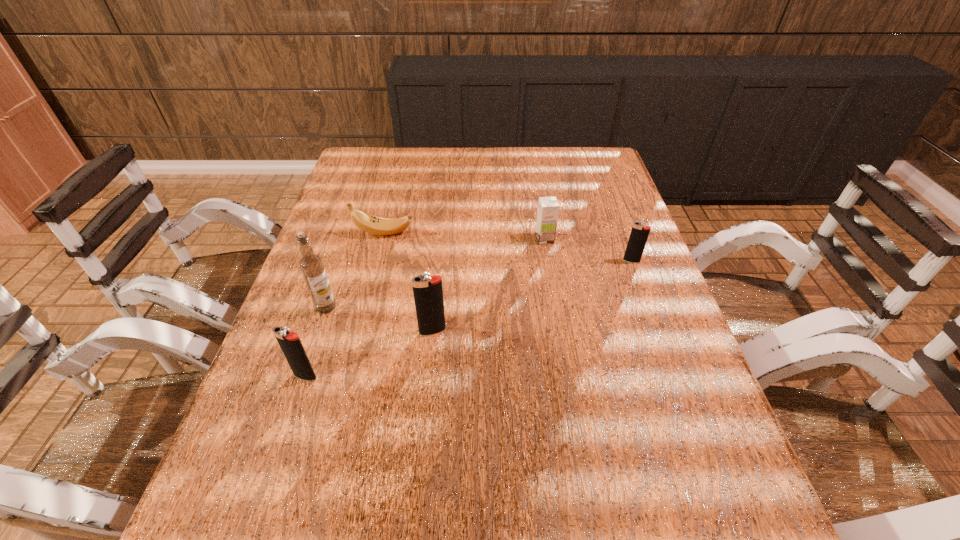
To make them evenly spaced by inserting another igniter among them, please locate a free space for this new igniter. Please provide its 2D coordinates. Your answer should be formatted as a tuple, i.e. [(x, y)], where the tuple contains the x and y coordinates of a point satisfying the conditions above.

[(540, 293)]